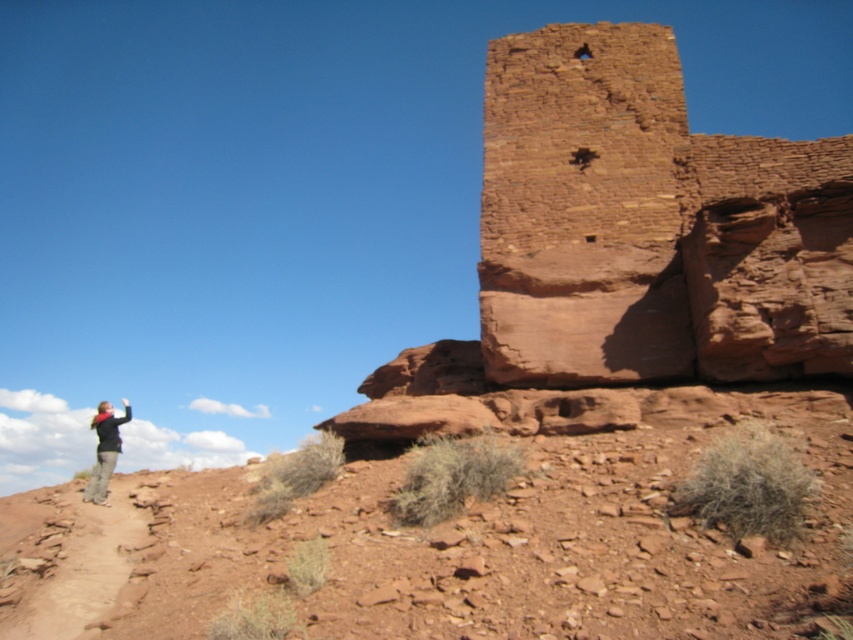
Question: Which point is farther from the camera taking this photo?

Choices:
 (A) (113, 417)
 (B) (567, 573)

Answer: (A)

Question: Is reddish-brown rock at lower left to the left of rustic stone ruins at upper right from the viewer's perspective?

Choices:
 (A) no
 (B) yes

Answer: (B)

Question: In this image, where is reddish-brown rock at lower left located relative to rustic stone ruins at upper right?

Choices:
 (A) left
 (B) right

Answer: (A)

Question: Which of the following is the farthest from the observer?

Choices:
 (A) (115, 452)
 (B) (349, 465)
 (C) (851, 205)

Answer: (A)

Question: Can you confirm if reddish-brown rock at lower left is wider than blurred denim jacket at lower left?

Choices:
 (A) yes
 (B) no

Answer: (B)

Question: Which object is the closest to the blurred denim jacket at lower left?

Choices:
 (A) rustic stone ruins at upper right
 (B) reddish-brown rock at lower left

Answer: (B)